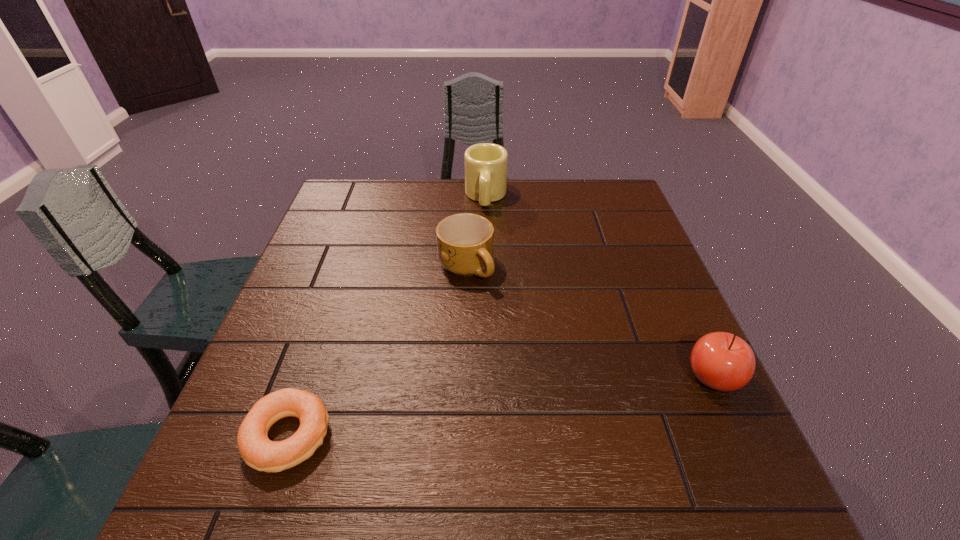
Identify the location of free spot on the desktop that is between the shortest object and the apple and is positioned on the side with the handle of the third tallest object. The height and width of the screenshot is (540, 960). (541, 401).

The height and width of the screenshot is (540, 960). What are the coordinates of `free spot on the desktop that is between the leftmost object and the rightmost object and is positioned with the handle on the side of the farther mug` in the screenshot? It's located at (475, 410).